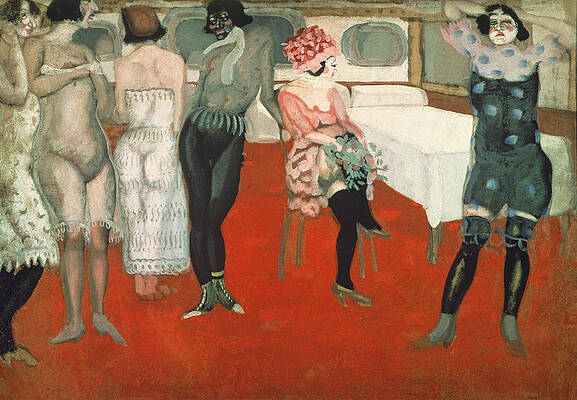
The height and width of the screenshot is (400, 577). I want to click on floor, so click(294, 355).